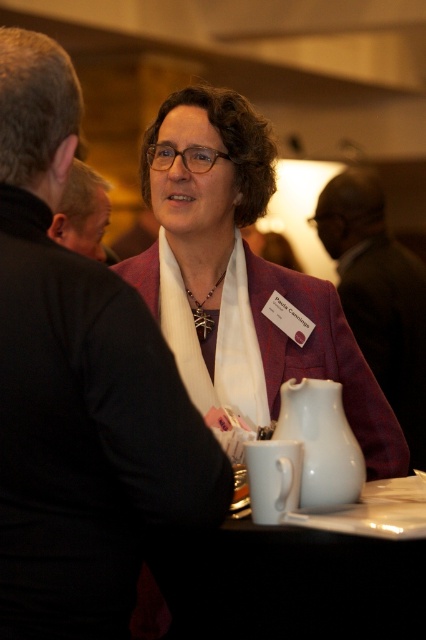
Question: Does matte purple jacket at center lie behind white glossy teapot at lower center?

Choices:
 (A) no
 (B) yes

Answer: (B)

Question: Can you confirm if matte purple jacket at center is wider than white ceramic table at lower center?

Choices:
 (A) no
 (B) yes

Answer: (B)

Question: Which point is farther to the camera?

Choices:
 (A) 304,346
 (B) 308,432

Answer: (A)

Question: Which is nearer to the matte purple jacket at center?

Choices:
 (A) white glossy teapot at lower center
 (B) white ceramic table at lower center

Answer: (A)

Question: Does matte purple jacket at center have a larger size compared to white glossy teapot at lower center?

Choices:
 (A) no
 (B) yes

Answer: (B)

Question: Which of the following is the farthest from the observer?

Choices:
 (A) white glossy teapot at lower center
 (B) white ceramic table at lower center

Answer: (A)